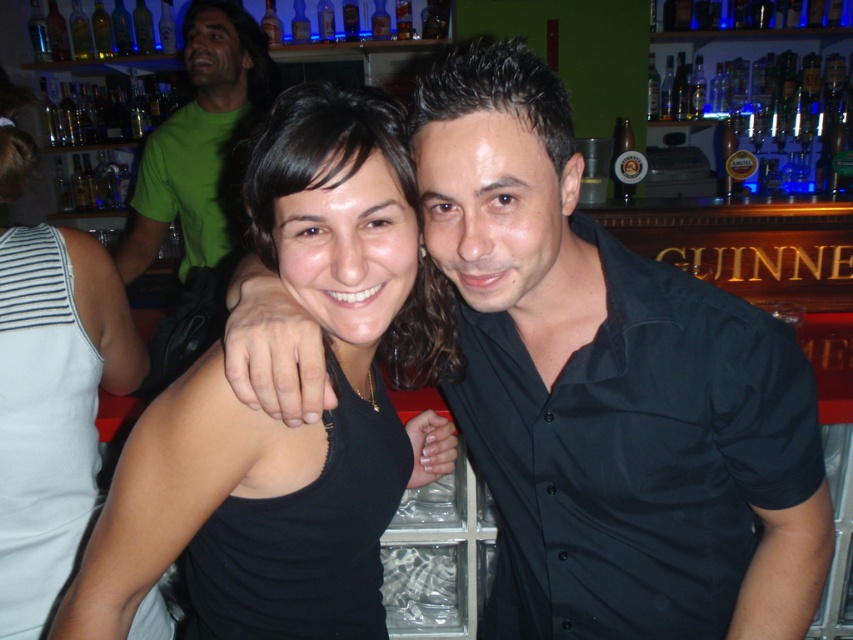
Is black matte shirt at center to the right of black matte tank top at center from the viewer's perspective?

Indeed, black matte shirt at center is positioned on the right side of black matte tank top at center.

Does point (509, 556) come in front of point (401, 276)?

No, it is not.

You are a GUI agent. You are given a task and a screenshot of the screen. Output one action in this format:
    pyautogui.click(x=<x>, y=<y>)
    Task: Click on the black matte shirt at center
    
    Given the screenshot: What is the action you would take?
    pyautogui.click(x=608, y=388)

Which is more to the right, black tank top at center or clear glass bottle at upper center?

Answer: clear glass bottle at upper center is more to the right.

Can you confirm if black tank top at center is positioned to the left of clear glass bottle at upper center?

Correct, you'll find black tank top at center to the left of clear glass bottle at upper center.

Measure the distance between point (50, 433) and camera.

1.15 meters

Where is `black tank top at center`? black tank top at center is located at coordinates (51, 406).

This screenshot has width=853, height=640. What are the coordinates of `black tank top at center` in the screenshot? It's located at (51, 406).

The height and width of the screenshot is (640, 853). What do you see at coordinates (51, 406) in the screenshot? I see `black tank top at center` at bounding box center [51, 406].

Image resolution: width=853 pixels, height=640 pixels. I want to click on black tank top at center, so click(x=51, y=406).